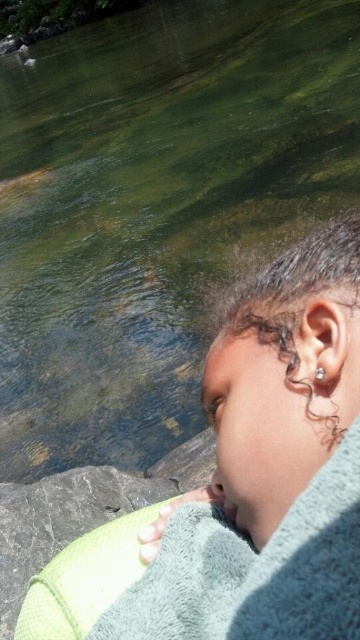
Question: Does green towel at lower right appear over dark curly hair at right?

Choices:
 (A) no
 (B) yes

Answer: (A)

Question: Which point is farther from the camera taking this photo?

Choices:
 (A) (357, 500)
 (B) (329, 282)

Answer: (B)

Question: In this image, where is green towel at lower right located relative to dark curly hair at right?

Choices:
 (A) below
 (B) above

Answer: (A)

Question: Does green towel at lower right have a larger size compared to dark curly hair at right?

Choices:
 (A) yes
 (B) no

Answer: (A)